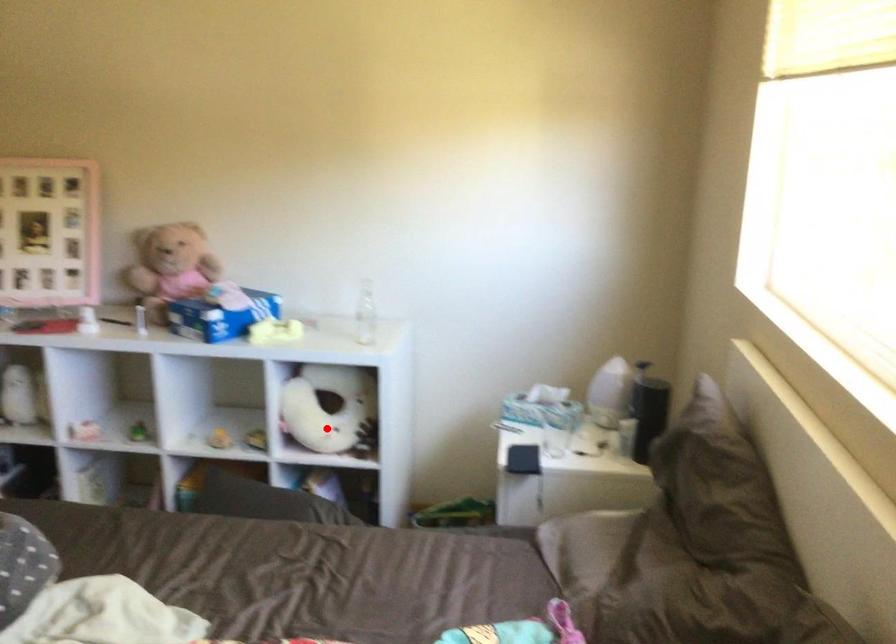
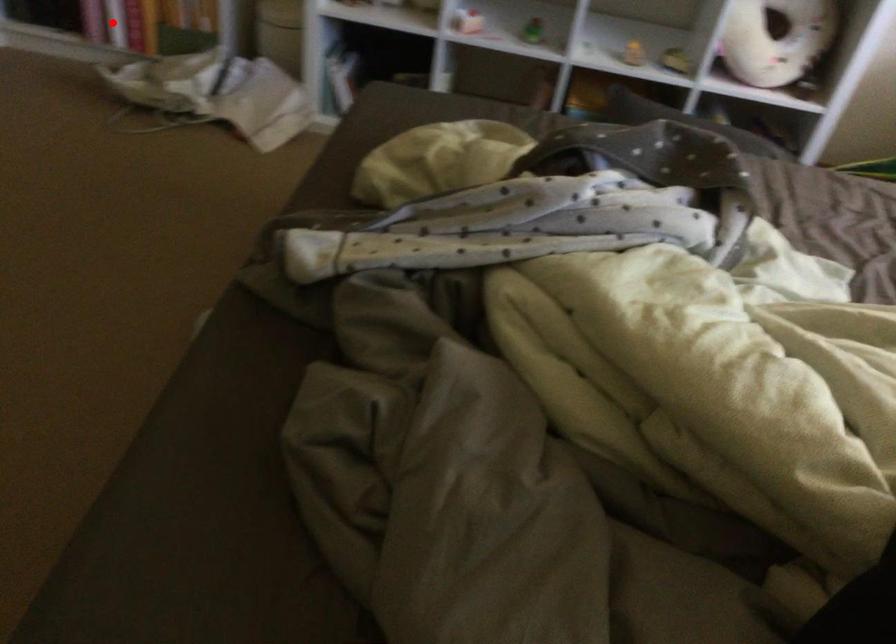
I am providing you with two images of the same scene from different viewpoints. A red point is marked on the first image and another point is marked on the second image. Is the marked point in image1 the same physical position as the marked point in image2?

No